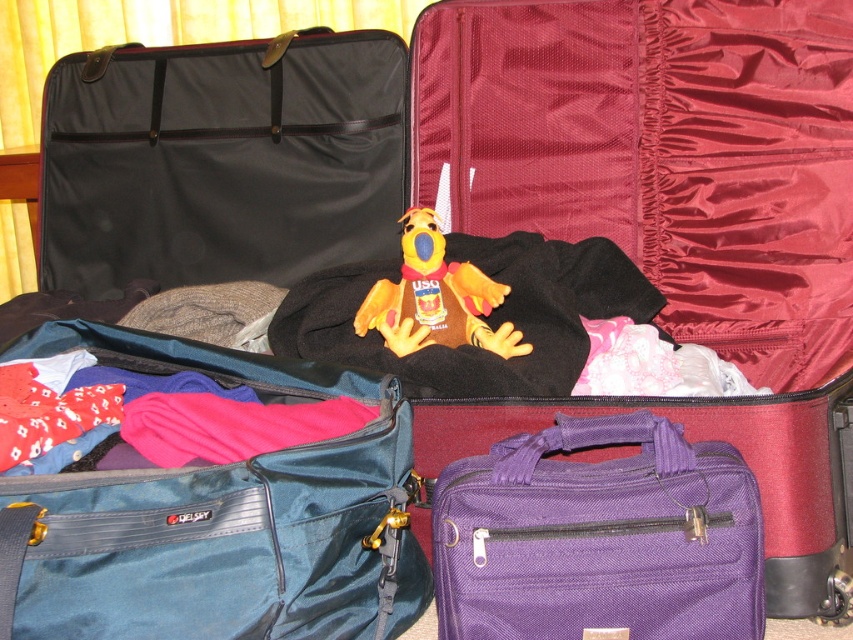
Based on the photo, you are packing for a trip and need to access the yellow plush toy at center. Can you reach it without moving the teal fabric bag at lower left?

The teal fabric bag at lower left is in front of the yellow plush toy at center, so you would need to move the teal fabric bag at lower left to access the yellow plush toy at center.

You are packing for a trip and need to place a new item between the teal fabric bag at lower left and the purple fabric briefcase at lower right in the suitcase. The item is 10 inches long. Will there be enough space between them to fit it?

The teal fabric bag at lower left is 8.48 inches away from the purple fabric briefcase at lower right. Since the item is 10 inches long, which is longer than the available space, it won

You are packing for a trip and need to access the purple fabric briefcase at lower right. Can you reach it without moving the teal fabric bag at lower left?

The teal fabric bag at lower left is in front of the purple fabric briefcase at lower right, so you cannot reach the purple fabric briefcase at lower right without moving the teal fabric bag at lower left.